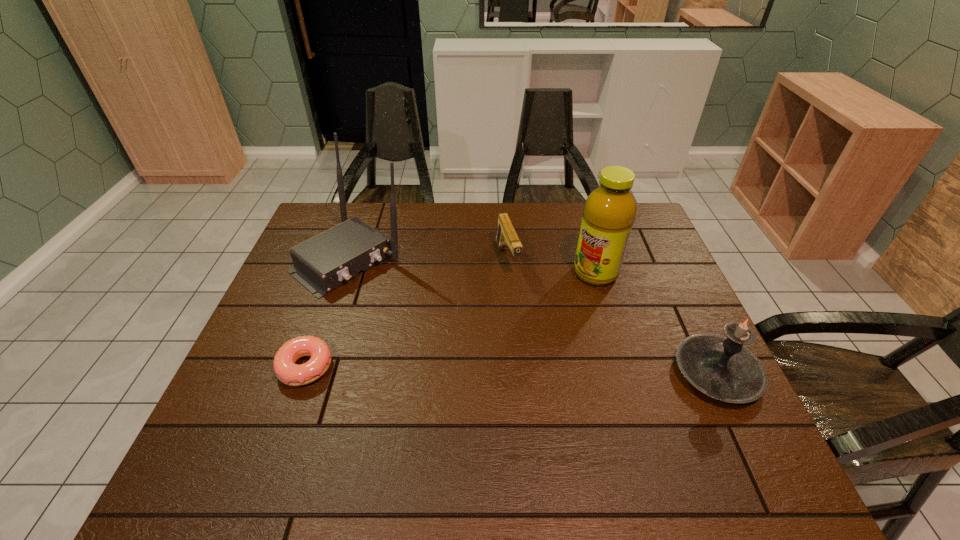
I want to click on free region at the near left corner, so click(x=259, y=406).

Identify the location of free region at the far right corner. This screenshot has width=960, height=540. (629, 242).

What are the coordinates of `free space that is in between the router and the fourth object from left to right` in the screenshot? It's located at pos(473,266).

The image size is (960, 540). Find the location of `free space between the shortest object and the third object from right to left`. free space between the shortest object and the third object from right to left is located at coordinates (406, 313).

Locate an element on the screen. free space between the rightmost object and the router is located at coordinates (534, 316).

I want to click on blank region between the shortest object and the router, so click(328, 313).

I want to click on free spot between the third shortest object and the router, so click(534, 316).

Image resolution: width=960 pixels, height=540 pixels. Find the location of `vacant area that lies between the fourth tallest object and the fruit juice`. vacant area that lies between the fourth tallest object and the fruit juice is located at coordinates (551, 266).

You are a GUI agent. You are given a task and a screenshot of the screen. Output one action in this format:
    pyautogui.click(x=<x>, y=<y>)
    Task: Click on the vacant point located between the shortest object and the fruit juice
    The image size is (960, 540).
    Given the screenshot: What is the action you would take?
    pyautogui.click(x=450, y=320)

Identify the location of free space between the third tallest object and the doughnut. The width and height of the screenshot is (960, 540). (511, 370).